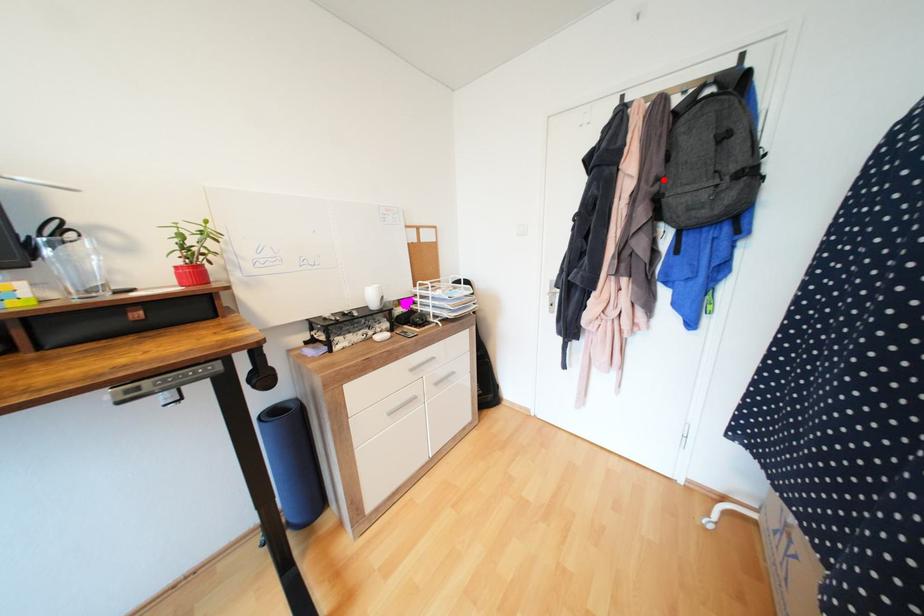
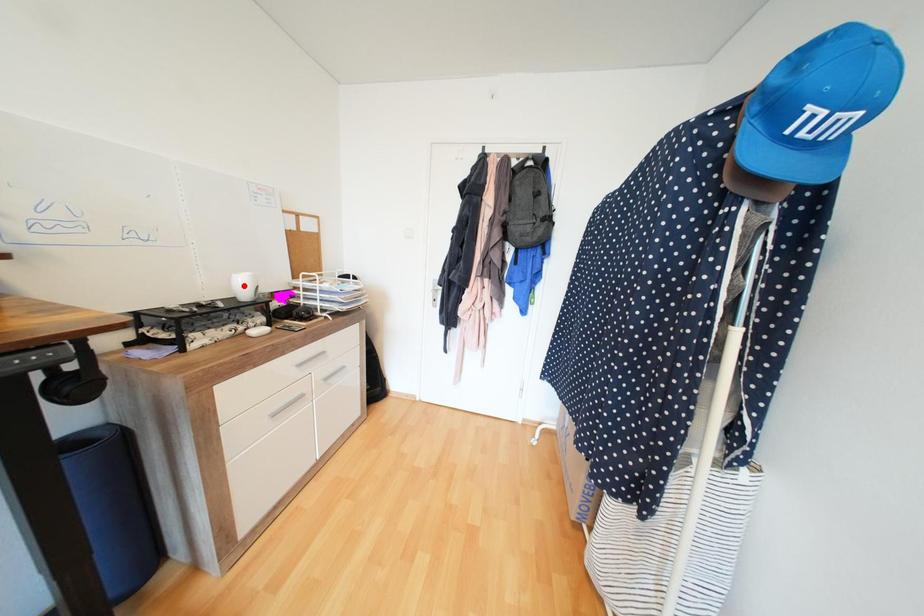
I am providing you with two images of the same scene from different viewpoints. A red point is marked on the first image and another point is marked on the second image. Is the red point in image1 aligned with the point shown in image2?

No